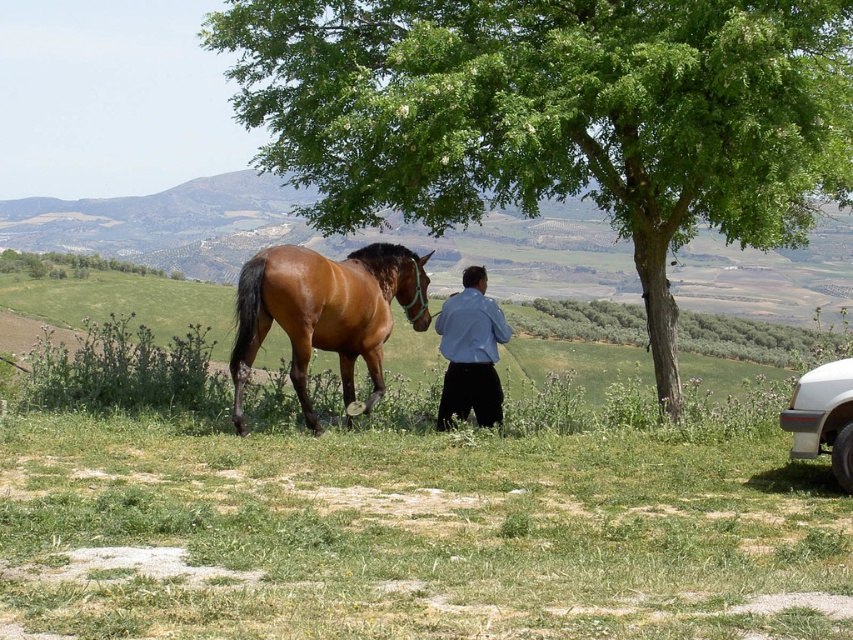
Question: Does brown glossy horse at center have a greater width compared to blue smooth shirt at center?

Choices:
 (A) yes
 (B) no

Answer: (A)

Question: Among these points, which one is farthest from the camera?

Choices:
 (A) (846, 488)
 (B) (444, 304)

Answer: (B)

Question: Does blue smooth shirt at center have a larger size compared to silver metallic car at lower right?

Choices:
 (A) no
 (B) yes

Answer: (B)

Question: Among these objects, which one is farthest from the camera?

Choices:
 (A) green leafy tree at upper left
 (B) green leafy tree at center

Answer: (A)

Question: Which is nearer to the blue smooth shirt at center?

Choices:
 (A) brown glossy horse at center
 (B) green leafy tree at upper left
 (C) silver metallic car at lower right
 (D) green leafy tree at center

Answer: (A)

Question: Is brown glossy horse at center positioned before green leafy tree at upper left?

Choices:
 (A) yes
 (B) no

Answer: (A)